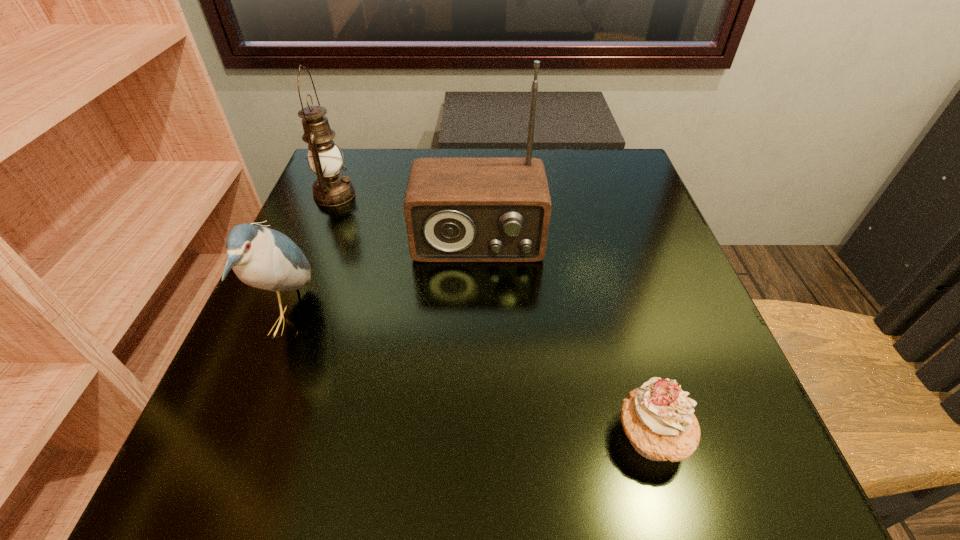
Where is `vacant space that is in between the farthest object and the bird`? vacant space that is in between the farthest object and the bird is located at coordinates (313, 258).

Where is `vacant space in between the cupcake and the third farthest object`? vacant space in between the cupcake and the third farthest object is located at coordinates (470, 379).

Choose which object is the nearest neighbor to the shortest object. Please provide its 2D coordinates. Your answer should be formatted as a tuple, i.e. [(x, y)], where the tuple contains the x and y coordinates of a point satisfying the conditions above.

[(456, 209)]

At what (x,y) coordinates should I click in order to perform the action: click on the closest object to the third shortest object. Please return your answer as a coordinate pair (x, y). Looking at the image, I should click on (456, 209).

Find the location of a particular element. free region that satisfies the following two spatial constraints: 1. at the tip of the second nearest object's beak; 2. on the left side of the cupcake is located at coordinates (245, 437).

Where is `free space that satisfies the following two spatial constraints: 1. on the front-facing side of the third nearest object; 2. at the tip of the bird's beak`? The width and height of the screenshot is (960, 540). free space that satisfies the following two spatial constraints: 1. on the front-facing side of the third nearest object; 2. at the tip of the bird's beak is located at coordinates (477, 321).

Find the location of a particular element. The image size is (960, 540). vacant space that satisfies the following two spatial constraints: 1. at the tip of the second nearest object's beak; 2. on the right side of the shortest object is located at coordinates pos(245,437).